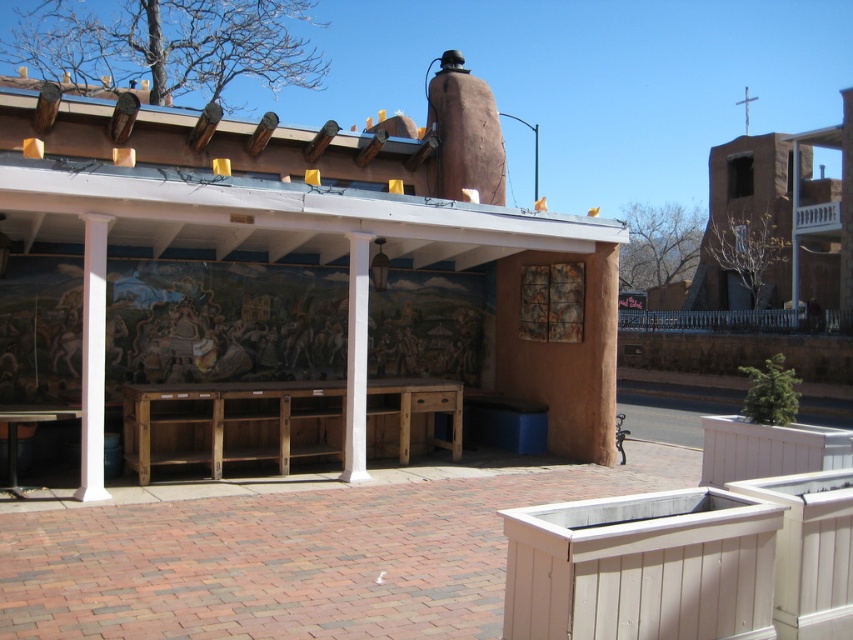
You are planning to host a small gathering at this rustic outdoor site. You want to seat guests comfortably. Which object, the wooden bench at center or the wooden picnic table at lower left, can accommodate more people?

The wooden picnic table at lower left can accommodate more people because it occupies more space than the wooden bench at center.